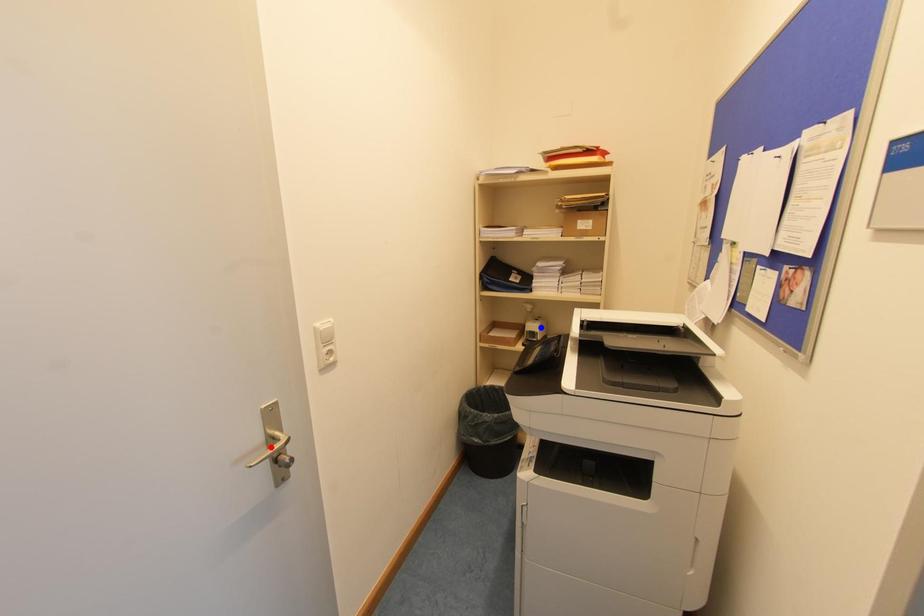
Question: Two points are marked on the image. Which point is closer to the camera?

Choices:
 (A) Blue point is closer.
 (B) Red point is closer.

Answer: (B)